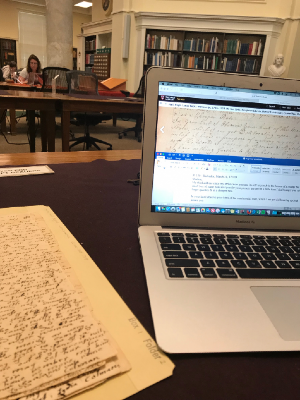
This screenshot has width=300, height=400. Identify the location of webcam. (261, 83).